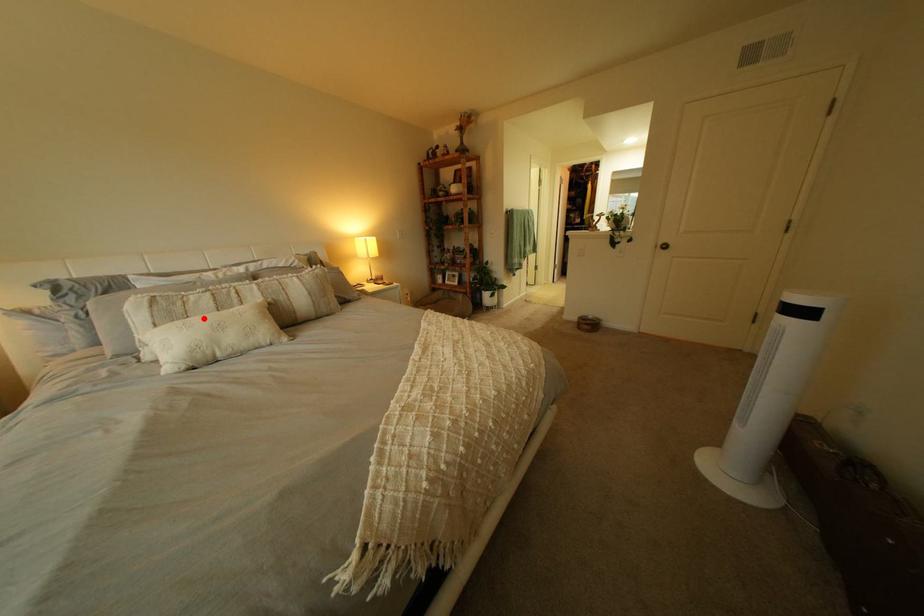
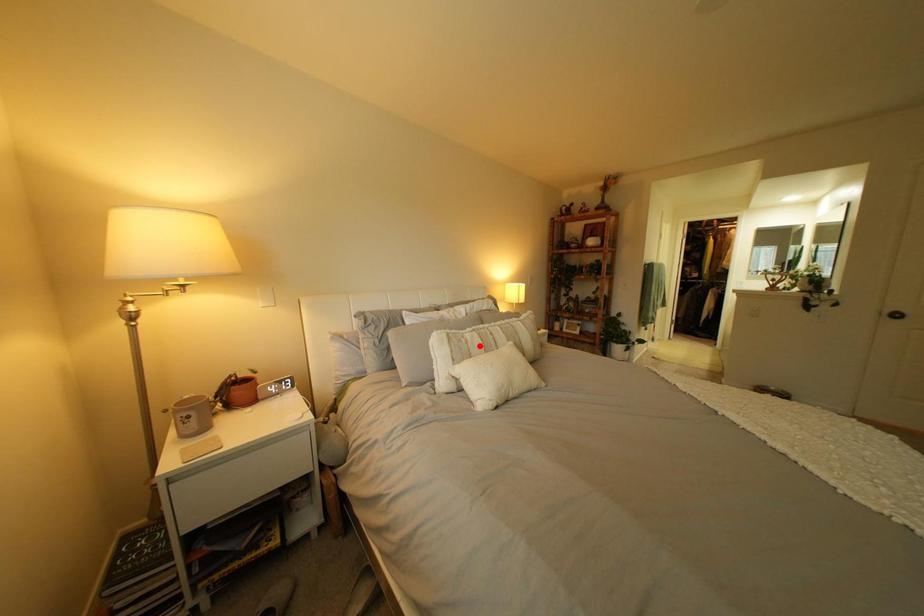
I am providing you with two images of the same scene from different viewpoints. A red point is marked on the first image and another point is marked on the second image. Are the points marked in image1 and image2 representing the same 3D position?

No